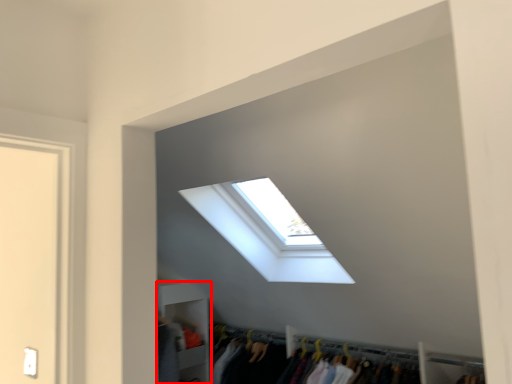
Question: In this image, where is shelf (annotated by the red box) located relative to window?

Choices:
 (A) right
 (B) left

Answer: (B)